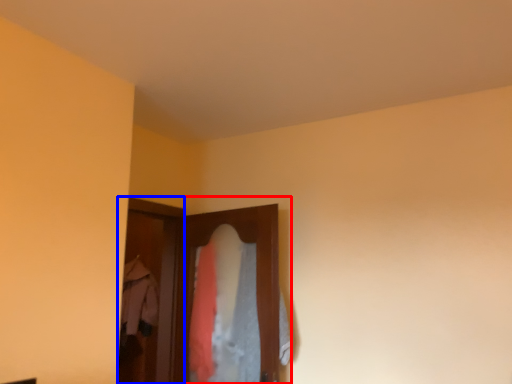
Question: Which object is closer to the camera taking this photo, closet (highlighted by a red box) or screen door (highlighted by a blue box)?

Choices:
 (A) closet
 (B) screen door

Answer: (A)